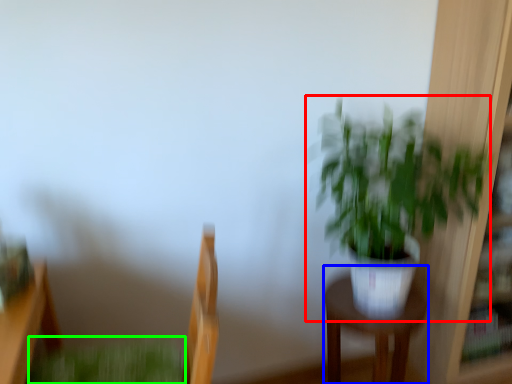
Question: Which object is the farthest from houseplant (highlighted by a red box)? Choose among these: furniture (highlighted by a blue box) or plant (highlighted by a green box).

Choices:
 (A) furniture
 (B) plant

Answer: (B)